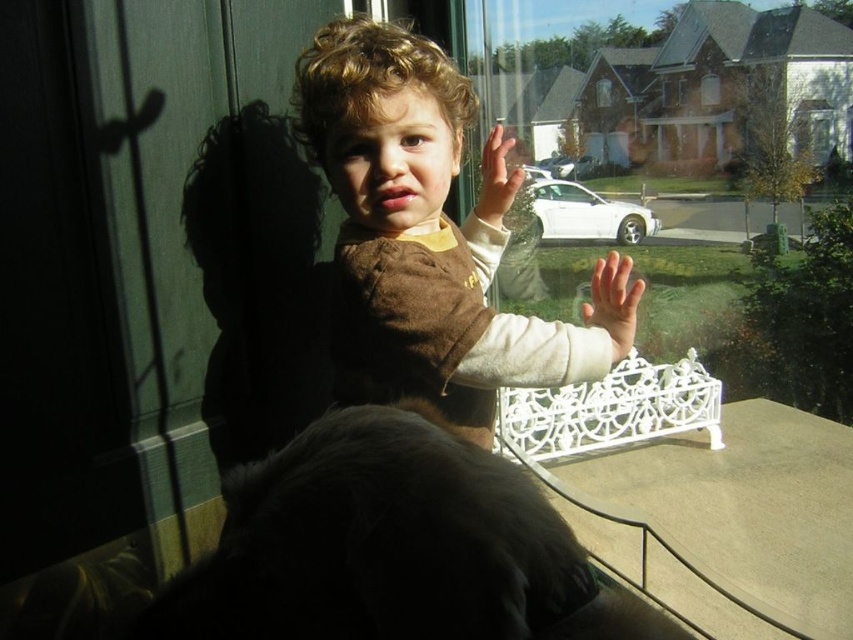
You are a photographer standing in front of the window. You want to take a photo of the smooth skin hand at center so that it appears large in the photo. Should you move closer or farther away from the hand?

To make the smooth skin hand at center appear large in the photo, you should move closer to it since the hand is currently 37.25 inches away from the viewer.

You are a robot trying to locate two specific points in the image. The first point is at coordinates point (622, 314) and the second is at point (502, 166). From the perspective of the child in the scene, which point is closer to the window?

Point (622, 314) is in front of point (502, 166), so from the child perspective, point (622, 314) is closer to the window.

The child in the image is trying to reach an object outside through the window. You are a safety assistant. Based on the position of the smooth skin hand at center and brown fuzzy sweater at center, can the child safely reach the object without falling?

The smooth skin hand at center is behind brown fuzzy sweater at center, which means the hand is positioned further back. This suggests the child is not leaning too far forward, so they can safely reach the object without falling.